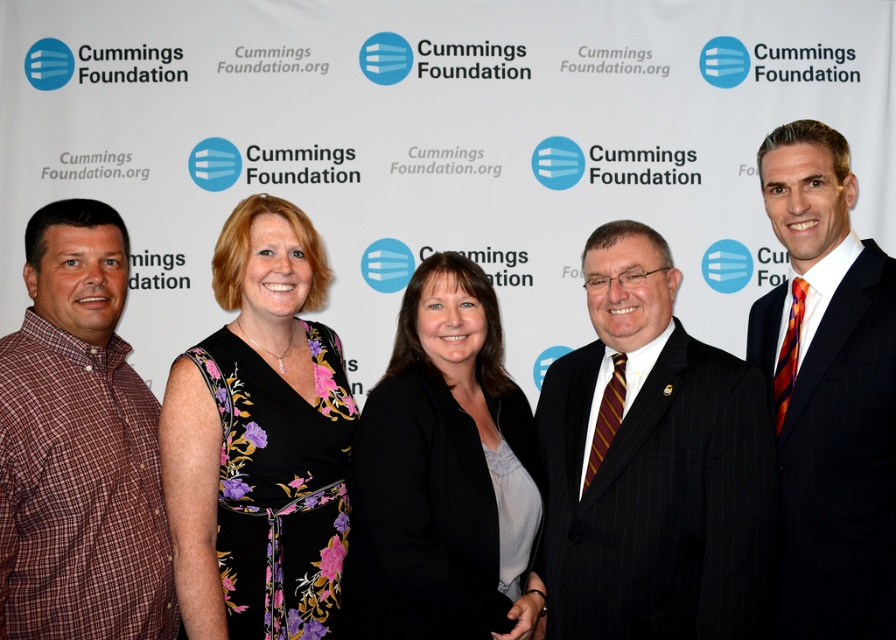
Question: Which object appears farthest from the camera in this image?

Choices:
 (A) plaid cotton shirt at left
 (B) black floral dress at center

Answer: (B)

Question: Can you confirm if plaid cotton shirt at left is positioned above black fabric at center?

Choices:
 (A) yes
 (B) no

Answer: (A)

Question: Is black pinstripe suit at center wider than black floral dress at center?

Choices:
 (A) yes
 (B) no

Answer: (A)

Question: Which point is closer to the camera?

Choices:
 (A) black pinstripe suit at right
 (B) black fabric at center

Answer: (A)

Question: Among these points, which one is nearest to the camera?

Choices:
 (A) (295, 292)
 (B) (360, 428)

Answer: (B)

Question: Can you confirm if black floral dress at center is bigger than plaid cotton shirt at left?

Choices:
 (A) yes
 (B) no

Answer: (A)